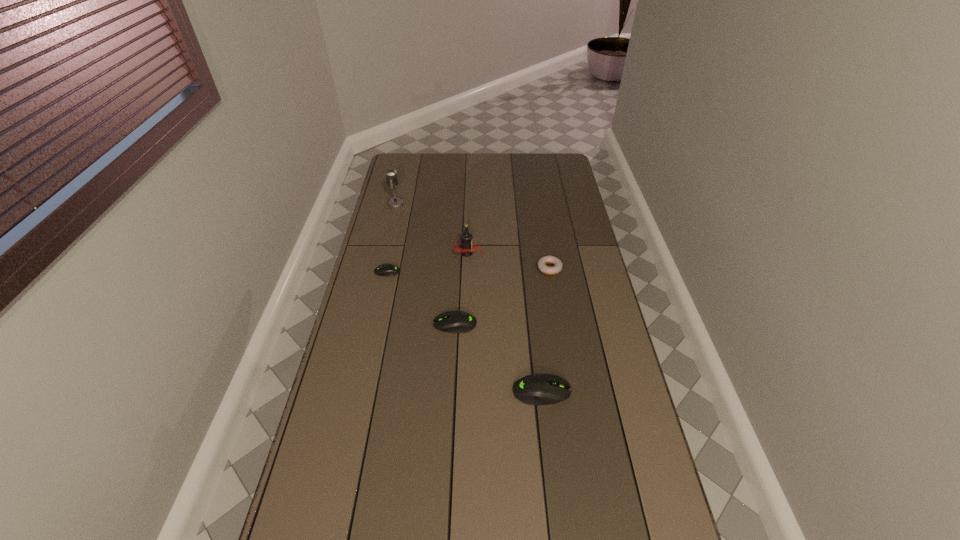
Where is `vacant space located 0.090m on the wheel side of the second tallest computer mouse`? vacant space located 0.090m on the wheel side of the second tallest computer mouse is located at coordinates (407, 325).

Find the location of `blank area located on the wheel side of the second tallest computer mouse`. blank area located on the wheel side of the second tallest computer mouse is located at coordinates (393, 325).

Where is `blank space located 0.150m on the wheel side of the second tallest computer mouse`? Image resolution: width=960 pixels, height=540 pixels. blank space located 0.150m on the wheel side of the second tallest computer mouse is located at coordinates click(x=390, y=325).

The width and height of the screenshot is (960, 540). I want to click on vacant space located 0.120m on the wheel side of the nearest computer mouse, so point(611,392).

Find the location of a particular element. The image size is (960, 540). vacant space located 0.230m on the label of the second tallest object is located at coordinates (540, 254).

The width and height of the screenshot is (960, 540). Identify the location of free space located 0.360m on the right of the microphone. (483, 203).

Where is `vacant space situated on the back of the doughnut`? The image size is (960, 540). vacant space situated on the back of the doughnut is located at coordinates (540, 206).

This screenshot has height=540, width=960. Find the location of `computer mouse that is at the left edge`. computer mouse that is at the left edge is located at coordinates (388, 270).

At what (x,y) coordinates should I click in order to perform the action: click on microphone that is at the left edge. Please return your answer as a coordinate pair (x, y). The height and width of the screenshot is (540, 960). Looking at the image, I should click on (391, 174).

The height and width of the screenshot is (540, 960). I want to click on object that is at the right edge, so click(x=542, y=262).